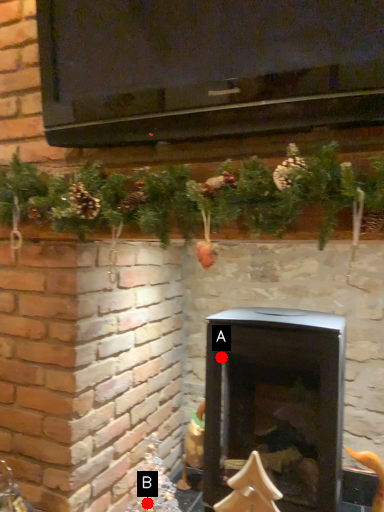
Question: Two points are circled on the image, labeled by A and B beside each circle. Which point is closer to the camera?

Choices:
 (A) A is closer
 (B) B is closer

Answer: (A)